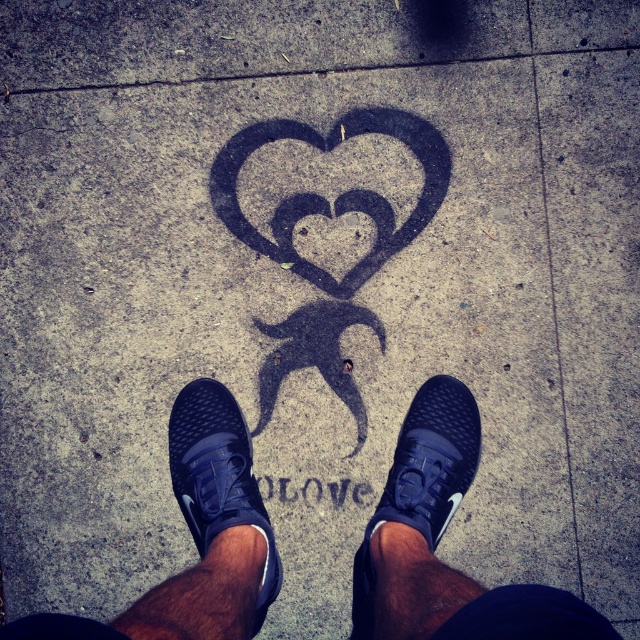
You are standing on the sidewalk looking at the chalk drawing of two interlocking hearts and the word LOVE. You notice two shoes at the center of the image. Which shoe is closer to you, the black mesh sneakers at center or the matte black shoe at center?

The black mesh sneakers at center is closer to you because it is in front of the matte black shoe at center.

You are a photographer trying to capture a closeup of the chalk drawing on the sidewalk. You notice two shoes in the foreground. Which shoe is wider, the black mesh sneakers at center or the matte black shoe at center?

The black mesh sneakers at center is wider than the matte black shoe at center.

You are standing on the sidewalk and want to place a new chalk drawing exactly 10 cm to the right of the black chalk heart at center. What are the coordinates of the point where you should start drawing?

The coordinates of the point to start drawing would be approximately 0.303 plus 0.010 in the x direction, so (339, 200).